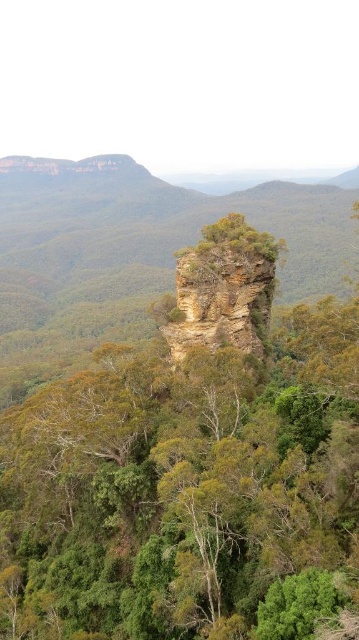
Question: Can you confirm if green rough rock formation at center is wider than brown rough rock at center?

Choices:
 (A) yes
 (B) no

Answer: (A)

Question: Can you confirm if green rough rock formation at center is positioned below brown rough rock at center?

Choices:
 (A) no
 (B) yes

Answer: (B)

Question: Does green rough rock formation at center appear on the right side of brown rough rock at center?

Choices:
 (A) no
 (B) yes

Answer: (A)